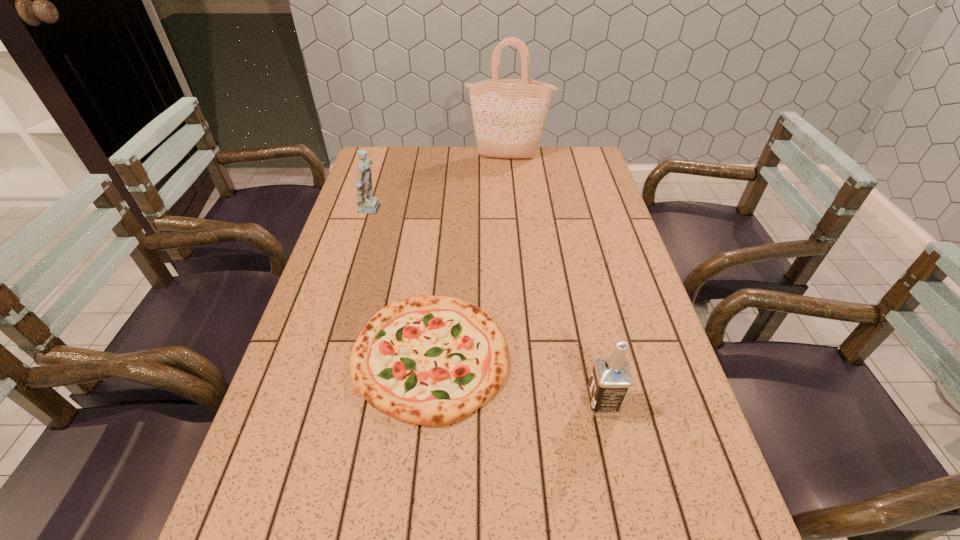
Image resolution: width=960 pixels, height=540 pixels. I want to click on free spot between the pizza and the vodka, so click(x=516, y=380).

This screenshot has height=540, width=960. Find the location of `the third closest object to the pizza`. the third closest object to the pizza is located at coordinates (508, 114).

Point out which object is positioned as the nearest to the vodka. Please provide its 2D coordinates. Your answer should be formatted as a tuple, i.e. [(x, y)], where the tuple contains the x and y coordinates of a point satisfying the conditions above.

[(430, 360)]

Locate an element on the screen. blank space that satisfies the following two spatial constraints: 1. on the front-facing side of the third nearest object; 2. on the left side of the shortest object is located at coordinates (328, 356).

At what (x,y) coordinates should I click in order to perform the action: click on vacant space that satisfies the following two spatial constraints: 1. on the back side of the pizza; 2. on the left side of the tallest object. Please return your answer as a coordinate pair (x, y). Image resolution: width=960 pixels, height=540 pixels. Looking at the image, I should click on (450, 158).

The image size is (960, 540). Find the location of `vacant position in the image that satisfies the following two spatial constraints: 1. on the front-facing side of the figurine; 2. on the back side of the pizza`. vacant position in the image that satisfies the following two spatial constraints: 1. on the front-facing side of the figurine; 2. on the back side of the pizza is located at coordinates (328, 356).